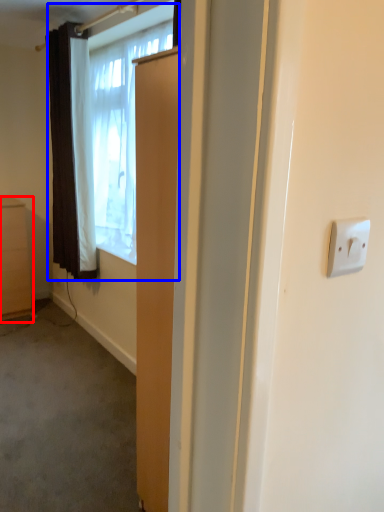
Question: Among these objects, which one is nearest to the camera, cabinetry (highlighted by a red box) or window (highlighted by a blue box)?

Choices:
 (A) cabinetry
 (B) window

Answer: (B)